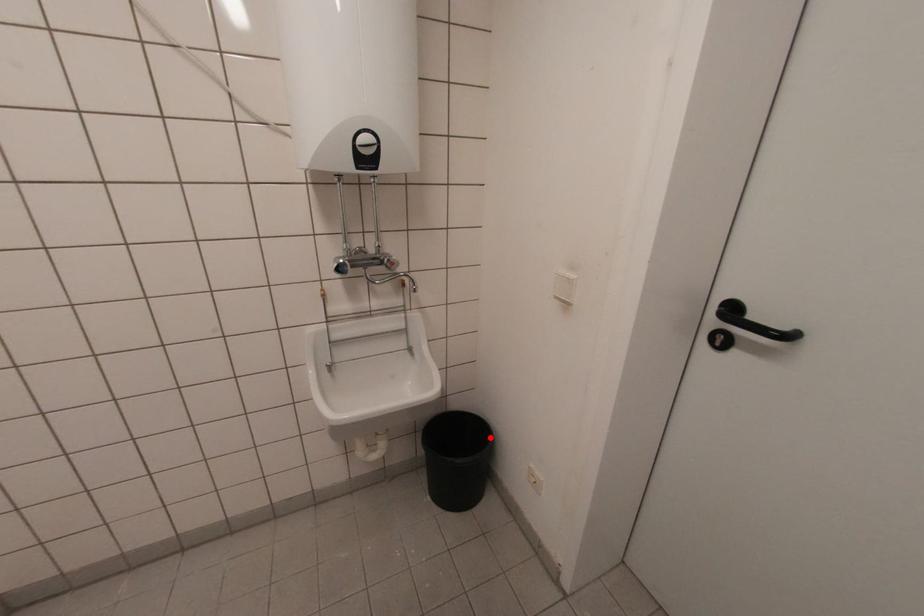
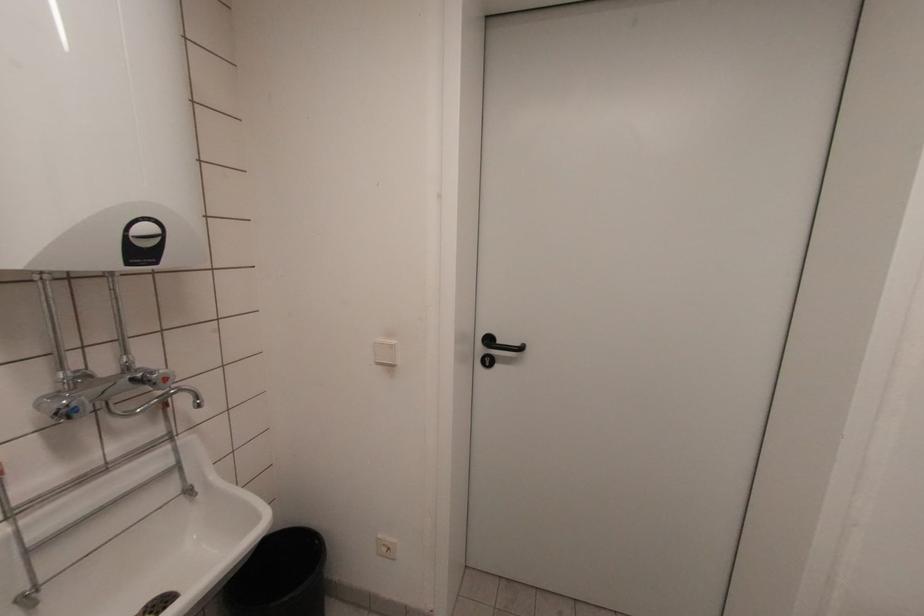
The point at the highlighted location is marked in the first image. Where is the corresponding point in the second image?

(317, 543)